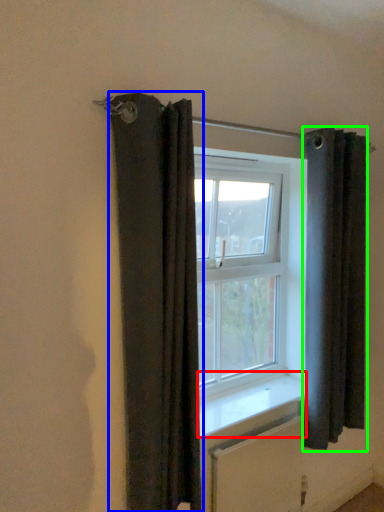
Question: Which object is positioned closest to window sill (highlighted by a red box)? Select from curtain (highlighted by a blue box) and curtain (highlighted by a green box).

Choices:
 (A) curtain
 (B) curtain

Answer: (B)